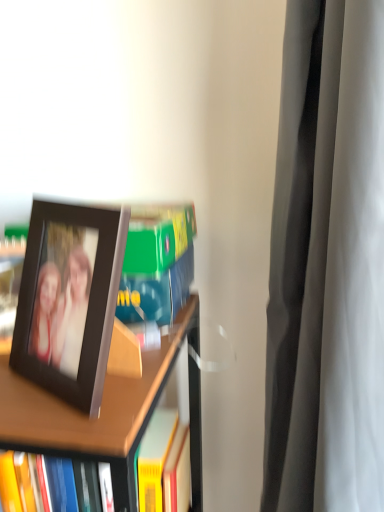
Identify the location of brown wooden bookcase at left. (100, 415).

What do you see at coordinates (100, 415) in the screenshot? I see `brown wooden bookcase at left` at bounding box center [100, 415].

Measure the distance between point (x=85, y=338) and camera.

Point (x=85, y=338) is 16.30 inches from camera.

What do you see at coordinates (69, 298) in the screenshot? I see `black plastic picture frame at left` at bounding box center [69, 298].

Measure the distance between black plastic picture frame at left and camera.

They are 15.48 inches apart.

This screenshot has height=512, width=384. Find the location of `black plastic picture frame at left`. black plastic picture frame at left is located at coordinates (69, 298).

This screenshot has width=384, height=512. I want to click on brown wooden bookcase at left, so click(x=100, y=415).

Does brown wooden bookcase at left appear on the right side of black plastic picture frame at left?

No.

Looking at this image, which object is further away from the camera taking this photo, brown wooden bookcase at left or black plastic picture frame at left?

Positioned behind is brown wooden bookcase at left.

Which is further, (x=63, y=436) or (x=78, y=236)?

The point (x=78, y=236) is behind.

From the image's perspective, is brown wooden bookcase at left above or below black plastic picture frame at left?

Based on their image positions, brown wooden bookcase at left is located beneath black plastic picture frame at left.

From the picture: From a real-world perspective, which object rests below the other?

brown wooden bookcase at left.

In the scene shown: Between brown wooden bookcase at left and black plastic picture frame at left, which one has larger width?

Wider between the two is brown wooden bookcase at left.

Does brown wooden bookcase at left have a lesser height compared to black plastic picture frame at left?

In fact, brown wooden bookcase at left may be taller than black plastic picture frame at left.

From the picture: Looking at the image, does brown wooden bookcase at left seem bigger or smaller compared to black plastic picture frame at left?

Clearly, brown wooden bookcase at left is larger in size than black plastic picture frame at left.

Is brown wooden bookcase at left outside of black plastic picture frame at left?

Yes, brown wooden bookcase at left is located beyond the bounds of black plastic picture frame at left.

Is brown wooden bookcase at left directly adjacent to black plastic picture frame at left?

No, brown wooden bookcase at left is not in contact with black plastic picture frame at left.

Is brown wooden bookcase at left looking in the opposite direction of black plastic picture frame at left?

No, brown wooden bookcase at left is not facing the opposite direction of black plastic picture frame at left.

In the scene shown: Measure the distance between brown wooden bookcase at left and black plastic picture frame at left.

brown wooden bookcase at left and black plastic picture frame at left are 14.22 centimeters apart from each other.

I want to click on bookcase that appears behind the black plastic picture frame at left, so click(100, 415).

Considering the relative positions of black plastic picture frame at left and brown wooden bookcase at left in the image provided, is black plastic picture frame at left to the left or to the right of brown wooden bookcase at left?

Clearly, black plastic picture frame at left is on the right of brown wooden bookcase at left in the image.

Considering their positions, is black plastic picture frame at left located in front of or behind brown wooden bookcase at left?

black plastic picture frame at left is positioned closer to the viewer than brown wooden bookcase at left.

Is point (111, 248) positioned after point (5, 429)?

Yes.

From the image's perspective, does black plastic picture frame at left appear lower than brown wooden bookcase at left?

No, from the image's perspective, black plastic picture frame at left is not beneath brown wooden bookcase at left.

Based on the photo, from a real-world perspective, is black plastic picture frame at left on top of brown wooden bookcase at left?

Yes, from a real-world perspective, black plastic picture frame at left is on top of brown wooden bookcase at left.

From the picture: Which of these two, black plastic picture frame at left or brown wooden bookcase at left, is thinner?

black plastic picture frame at left.

Considering the sizes of objects black plastic picture frame at left and brown wooden bookcase at left in the image provided, who is taller, black plastic picture frame at left or brown wooden bookcase at left?

Standing taller between the two is brown wooden bookcase at left.

Does black plastic picture frame at left have a larger size compared to brown wooden bookcase at left?

No.

Is black plastic picture frame at left inside or outside of brown wooden bookcase at left?

black plastic picture frame at left is outside brown wooden bookcase at left.

In the scene shown: Is black plastic picture frame at left not near brown wooden bookcase at left?

They are positioned close to each other.

Is black plastic picture frame at left aimed at brown wooden bookcase at left?

No, black plastic picture frame at left does not turn towards brown wooden bookcase at left.

How many degrees apart are the facing directions of black plastic picture frame at left and brown wooden bookcase at left?

The angular difference between black plastic picture frame at left and brown wooden bookcase at left is 29.3 degrees.

Where is `picture frame located in front of the brown wooden bookcase at left`? The width and height of the screenshot is (384, 512). picture frame located in front of the brown wooden bookcase at left is located at coordinates (69, 298).

Where is `bookcase below the black plastic picture frame at left (from the image's perspective)`? Image resolution: width=384 pixels, height=512 pixels. bookcase below the black plastic picture frame at left (from the image's perspective) is located at coordinates (100, 415).

Locate an element on the screen. The height and width of the screenshot is (512, 384). picture frame above the brown wooden bookcase at left (from a real-world perspective) is located at coordinates (69, 298).